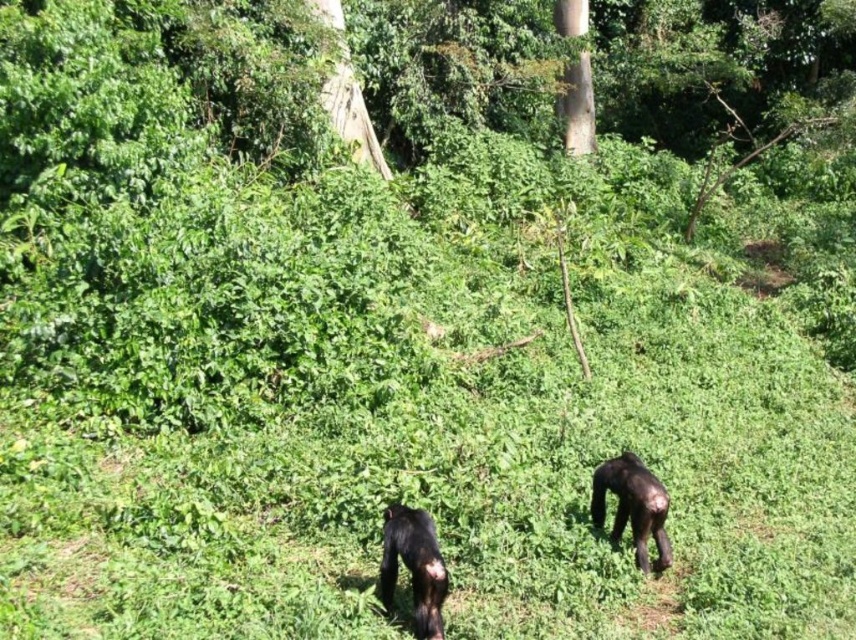
Who is positioned more to the left, shiny dark brown chimpanzee at lower center or brown rough tree at upper center?

From the viewer's perspective, shiny dark brown chimpanzee at lower center appears more on the left side.

Measure the distance from shiny dark brown chimpanzee at lower center to brown rough tree at upper center.

A distance of 39.13 feet exists between shiny dark brown chimpanzee at lower center and brown rough tree at upper center.

Which is in front, point (432, 593) or point (593, 131)?

Point (432, 593) is in front.

Where is `shiny dark brown chimpanzee at lower center`? This screenshot has height=640, width=856. shiny dark brown chimpanzee at lower center is located at coordinates (413, 566).

Does dark brown fur chimpanzee at lower right appear over brown rough tree at upper center?

No.

Does dark brown fur chimpanzee at lower right have a larger size compared to brown rough tree at upper center?

Actually, dark brown fur chimpanzee at lower right might be smaller than brown rough tree at upper center.

Is point (598, 525) behind point (591, 120)?

No, it is in front of (591, 120).

Identify the location of dark brown fur chimpanzee at lower right. Image resolution: width=856 pixels, height=640 pixels. (632, 506).

Can you confirm if shiny dark brown chimpanzee at lower center is bigger than dark brown fur chimpanzee at lower right?

Actually, shiny dark brown chimpanzee at lower center might be smaller than dark brown fur chimpanzee at lower right.

Which is in front, point (437, 628) or point (645, 509)?

Point (437, 628) is more forward.

Is point (424, 612) farther from viewer compared to point (669, 560)?

No.

This screenshot has width=856, height=640. I want to click on shiny dark brown chimpanzee at lower center, so click(x=413, y=566).